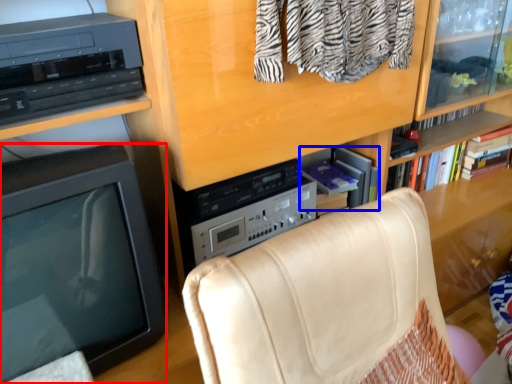
Question: Which of the following is the closest to the observer, television (highlighted by a red box) or book (highlighted by a blue box)?

Choices:
 (A) television
 (B) book

Answer: (A)